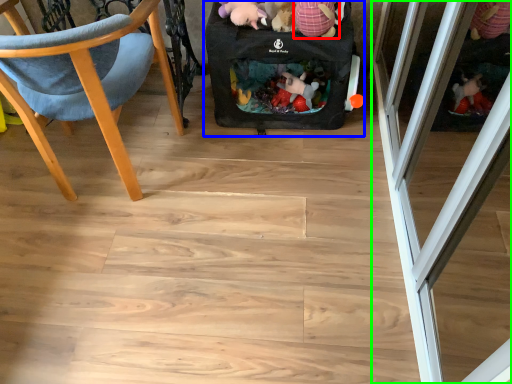
Question: Estimate the real-world distances between objects in this image. Which object is farther from toy (highlighted by a red box), baby carriage (highlighted by a blue box) or screen door (highlighted by a green box)?

Choices:
 (A) baby carriage
 (B) screen door

Answer: (B)